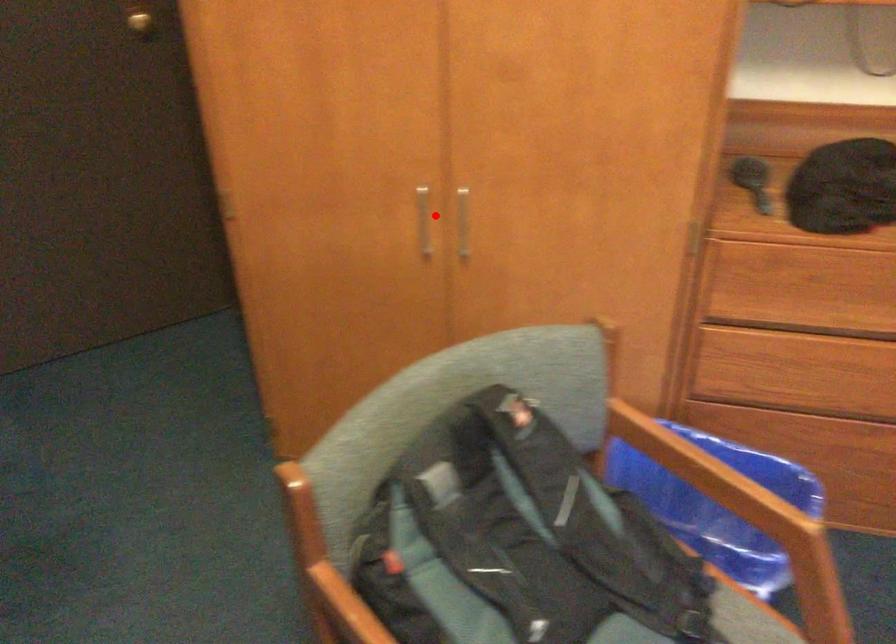
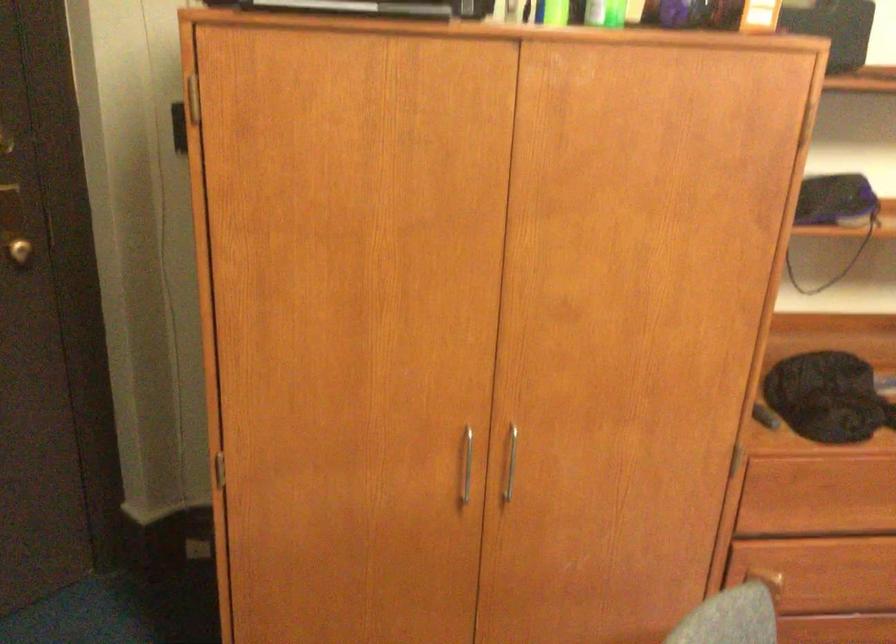
Locate, in the second image, the point that corresponds to the highlighted location in the first image.

(466, 465)